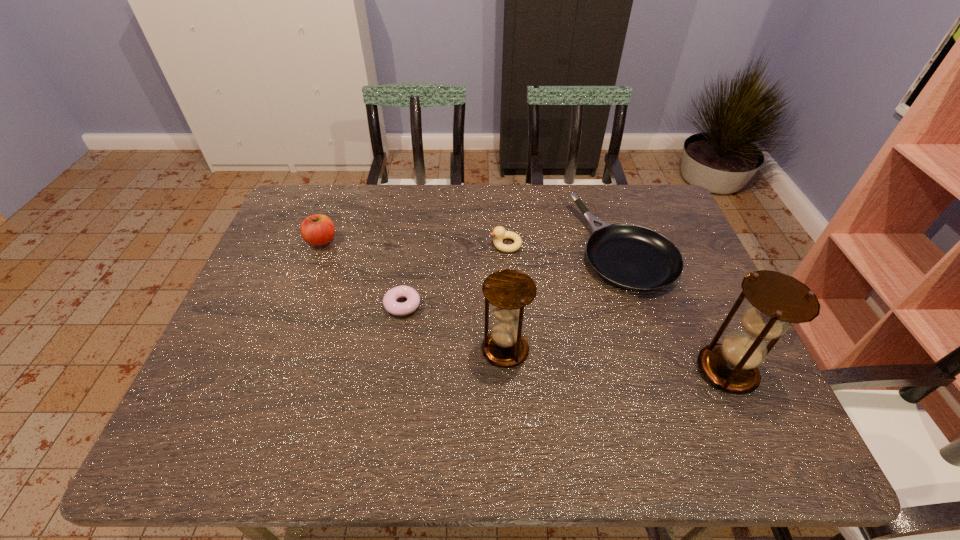
Considering the uniform spacing of hourglasss, where should an additional hourglass be positioned on the left? Please locate a free spot. Please provide its 2D coordinates. Your answer should be formatted as a tuple, i.e. [(x, y)], where the tuple contains the x and y coordinates of a point satisfying the conditions above.

[(300, 331)]